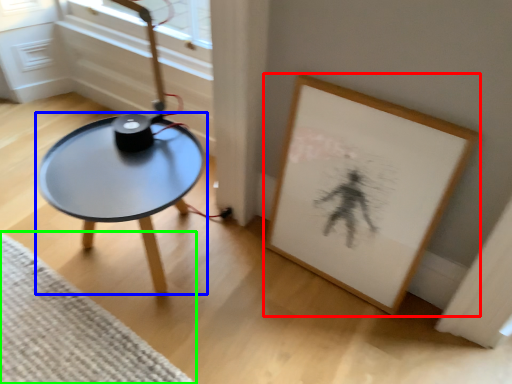
Question: Estimate the real-world distances between objects in this image. Which object is closer to picture frame (highlighted by a red box), coffee table (highlighted by a blue box) or mat (highlighted by a green box)?

Choices:
 (A) coffee table
 (B) mat

Answer: (A)